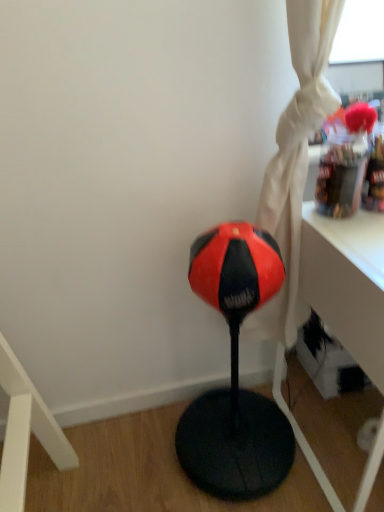
The width and height of the screenshot is (384, 512). In order to click on vacant space underneath white glossy table at upper right (from a real-world perspective) in this screenshot , I will do `click(338, 424)`.